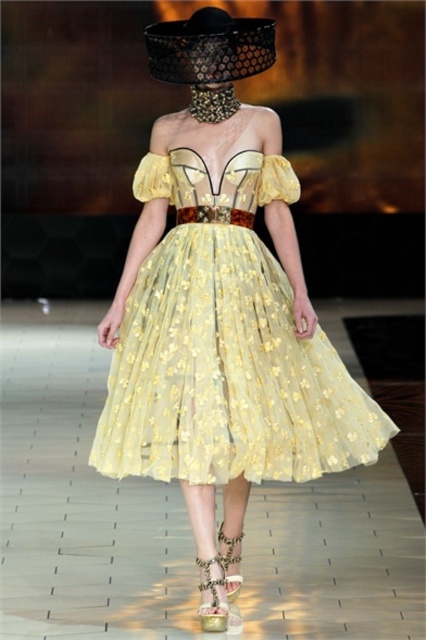
Can you confirm if yellow tulle dress at center is positioned to the right of leopard print fabric sandal at lower center?

Indeed, yellow tulle dress at center is positioned on the right side of leopard print fabric sandal at lower center.

Is yellow tulle dress at center taller than leopard print fabric sandal at lower center?

Indeed, yellow tulle dress at center has a greater height compared to leopard print fabric sandal at lower center.

Is point (288, 368) positioned after point (213, 560)?

Yes, it is behind point (213, 560).

Identify the location of yellow tulle dress at center. Image resolution: width=426 pixels, height=640 pixels. (224, 346).

Can you confirm if matte yellow fabric at upper center is positioned to the left of gold metallic sandal at lower center?

Incorrect, matte yellow fabric at upper center is not on the left side of gold metallic sandal at lower center.

Who is higher up, matte yellow fabric at upper center or gold metallic sandal at lower center?

matte yellow fabric at upper center is higher up.

Where is `matte yellow fabric at upper center`? matte yellow fabric at upper center is located at coordinates (261, 129).

Is black woven hat at upper center below gold metallic sandal at lower center?

No, black woven hat at upper center is not below gold metallic sandal at lower center.

Locate an element on the screen. This screenshot has height=640, width=426. black woven hat at upper center is located at coordinates [x=210, y=48].

Where is `black woven hat at upper center`? The image size is (426, 640). black woven hat at upper center is located at coordinates (210, 48).